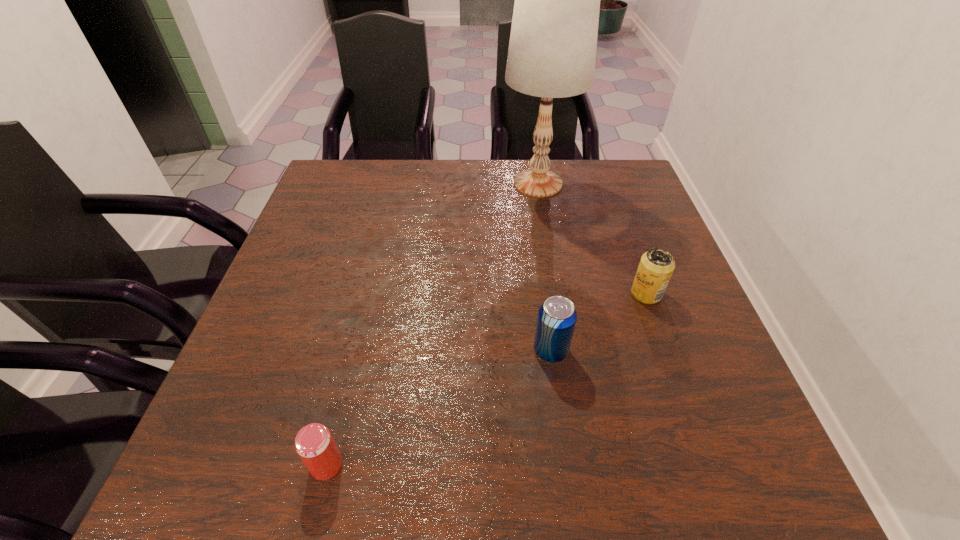
You are a GUI agent. You are given a task and a screenshot of the screen. Output one action in this format:
    pyautogui.click(x=<x>, y=<y>)
    Task: Click on the farthest object
    The image size is (960, 540).
    Given the screenshot: What is the action you would take?
    pyautogui.click(x=552, y=50)

The image size is (960, 540). Find the location of `the tallest object`. the tallest object is located at coordinates (552, 50).

Where is `the second nearest beer can`? the second nearest beer can is located at coordinates (557, 316).

At what (x,y) coordinates should I click in order to perform the action: click on the second nearest object. Please return your answer as a coordinate pair (x, y). The width and height of the screenshot is (960, 540). Looking at the image, I should click on (557, 316).

Identify the location of the third nearest object. (656, 266).

This screenshot has height=540, width=960. What are the coordinates of `the farthest beer can` in the screenshot? It's located at (656, 266).

You are a GUI agent. You are given a task and a screenshot of the screen. Output one action in this format:
    pyautogui.click(x=<x>, y=<y>)
    Task: Click on the leftmost object
    The height and width of the screenshot is (540, 960).
    Given the screenshot: What is the action you would take?
    pyautogui.click(x=314, y=444)

Identify the location of the shortest beer can. This screenshot has height=540, width=960. (314, 444).

Where is `vacant space located on the left of the lamp`? vacant space located on the left of the lamp is located at coordinates (449, 184).

Locate an element on the screen. The width and height of the screenshot is (960, 540). vacant space located on the back of the third farthest object is located at coordinates (536, 238).